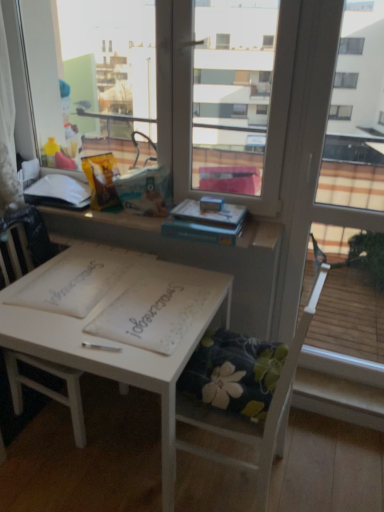
Image resolution: width=384 pixels, height=512 pixels. I want to click on free space in front of white paper notebook at center, the 1th notebook in the left-to-right sequence, so click(66, 327).